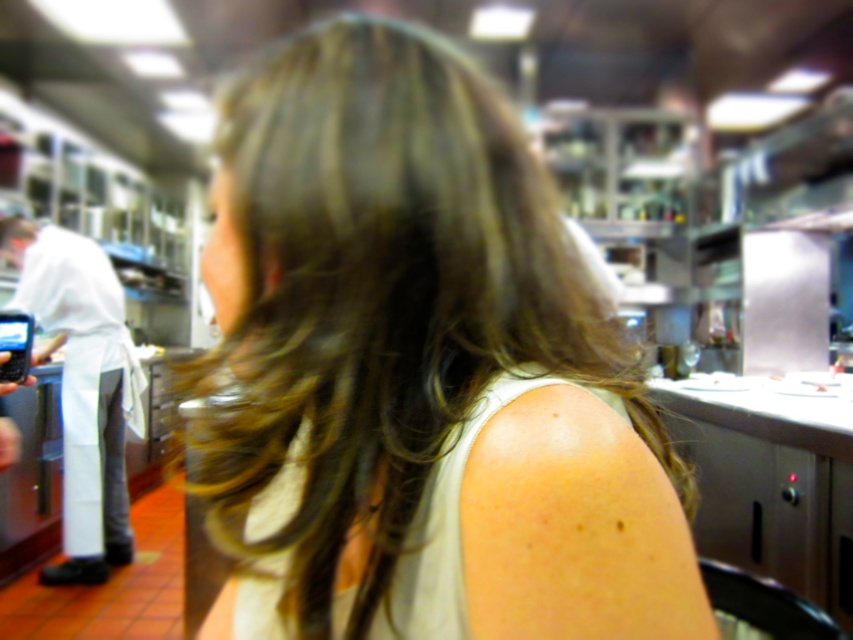
You are a new chef in the commercial kitchen and need to locate your white fabric apron at left. According to the scene, where exactly is it positioned?

The white fabric apron at left is positioned at point 0.606 on the x axis and 0.098 on the y axis.